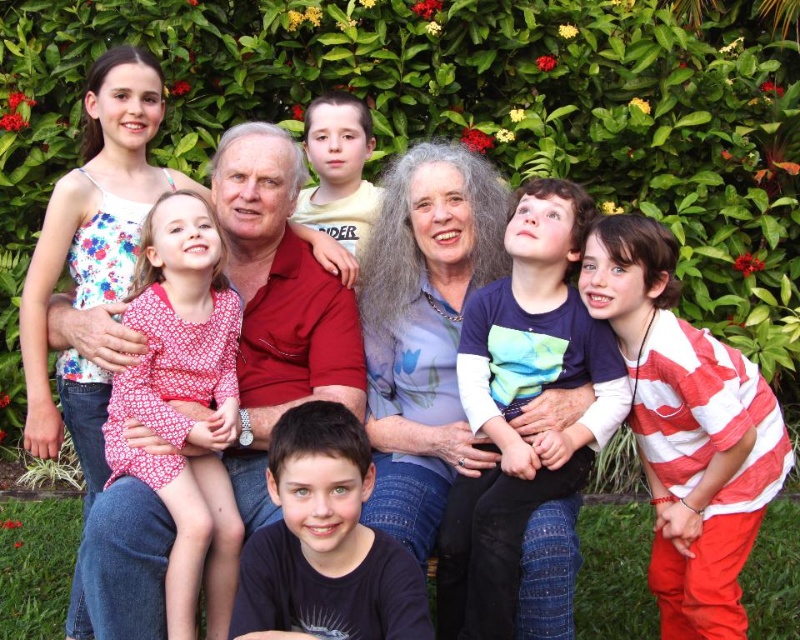
You are standing in front of the family photo taken in front of a hedge with red flowers. There is a point marked at coordinates (522,404). What object is located at that point?

The point at coordinates (522,404) indicates the dark blue cotton shirt at center.